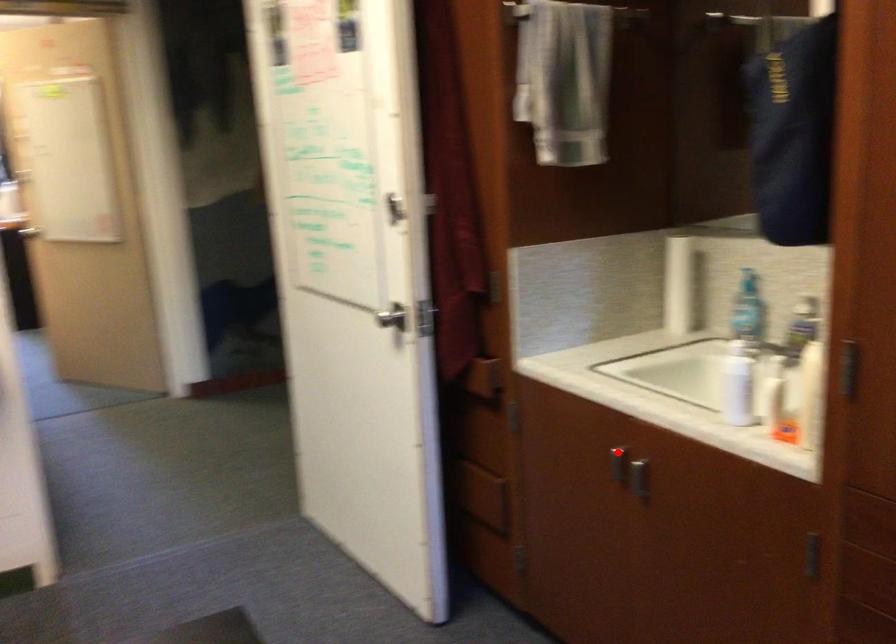
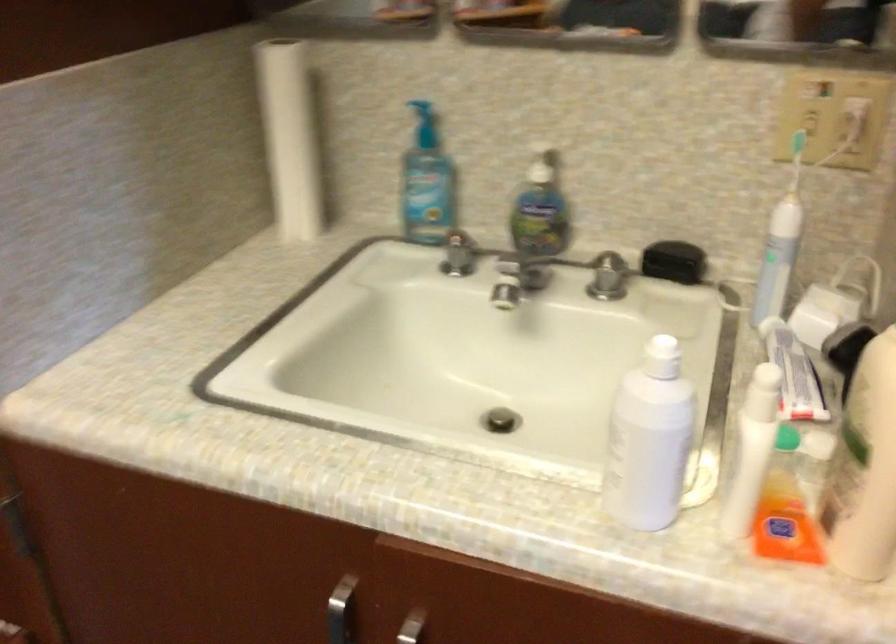
Where in the second image is the point corresponding to the highlighted location from the first image?

(340, 611)